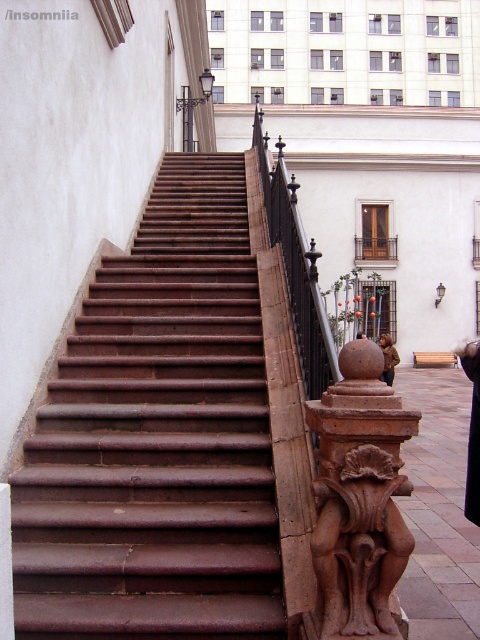
You are standing at the bottom of the brown stone stairs at center and want to reach the brown stone carving at center. Which direction should you move to get there?

The brown stone stairs at center are located below the brown stone carving at center, so you should move upwards to reach it.

You are an architect inspecting the building. You need to determine if the brown stone stairs at center can be seen from the top of the black wrought iron railing at upper center. Based on their heights, what do you conclude?

The brown stone stairs at center is shorter than the black wrought iron railing at upper center, so yes, the stairs can be seen from the top of the railing because they are lower in height.